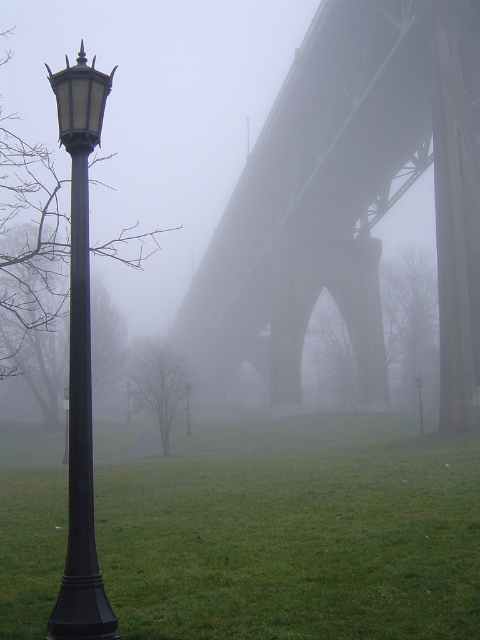
You are standing at the base of the black lamppost on the left side of the frame. You want to take a photo that includes both point A at point (478, 492) and point B at point (62, 586). Which point should you focus on first to ensure both are in focus?

You should focus on point B at point (62, 586) first because it is closer to you than point A at point (478, 492), which is further away. By focusing on the closer point, the further point will also be within the depth of field.

You are a landscape architect evaluating the scene. You need to determine if the green grass at left can be mowed without damaging the black matte pole at left. Based on their heights, is this feasible?

The green grass at left has a lesser height compared to the black matte pole at left, so mowing the grass should be feasible without damaging the pole as the grass is shorter.